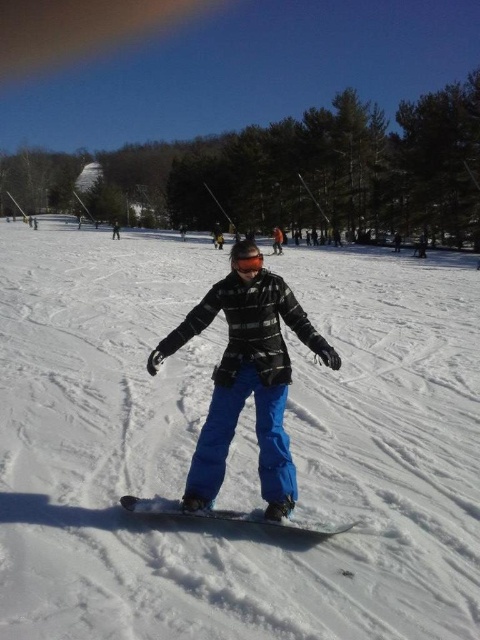
You are a drone operator trying to capture the snowboarder. The drone is currently at the point of coordinates 0.5, 0.5. The white matte snowboard at center is located at 0.678, 0.412. To get a clear shot of the snowboarder, should the drone move north or south?

The white matte snowboard at center is located at coordinates (197, 433). Since the drone is at (240, 320), the snowboarder is to the east and slightly south of the drone. To get closer, the drone should move south.